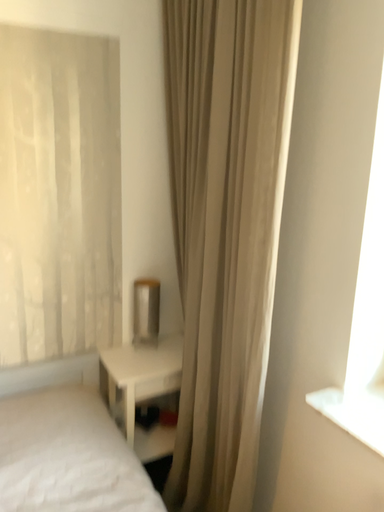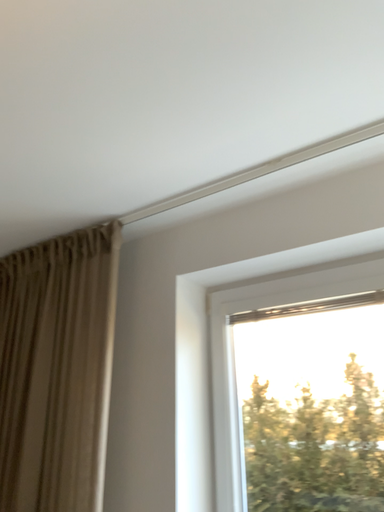
Question: Which way did the camera rotate in the video?

Choices:
 (A) rotated downward
 (B) rotated upward

Answer: (B)